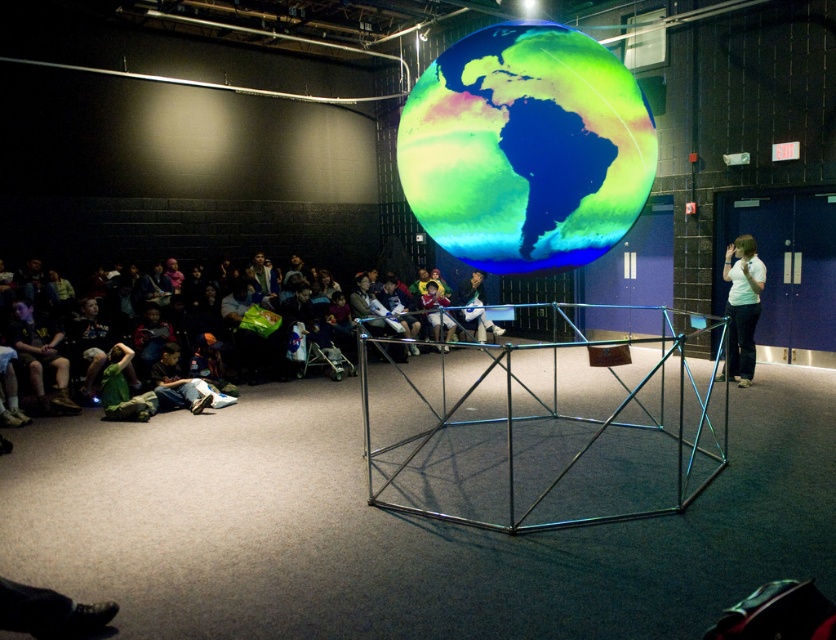
You are an attendee at the presentation. You notice the translucent plastic globe at center and the white shirt at right. Which object is positioned more to the left in the scene?

The translucent plastic globe at center is positioned to the left of the white shirt at right, so it is more to the left.

You are organizing a small event and need to place a 2.5 meter long table between the green fabric jacket at lower left and the white shirt at right. Can the table fit in the space between them?

The distance between the green fabric jacket at lower left and the white shirt at right is 5.78 meters. Since the table is 2.5 meters long, it can easily fit in the space between them as there is enough room.

You are a stagehand who needs to move a 15 feet long extension cord from the translucent plastic globe at center to the white shirt at right. Can you lay the cord directly between them without bending it?

The distance between the translucent plastic globe at center and the white shirt at right is 14.59 feet, so the 15 feet cord can be laid directly between them without bending, as it is slightly longer than the required distance.